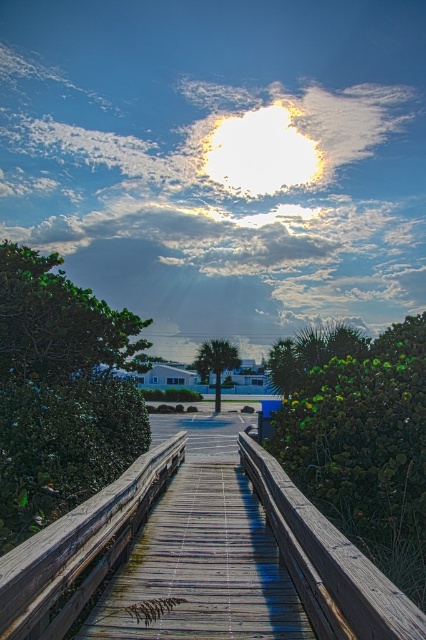
Find the location of a particular element. This screenshot has height=640, width=426. weathered wood boardwalk at center is located at coordinates (x=204, y=552).

Does point (203, 500) come behind point (23, 596)?

Yes, it is behind point (23, 596).

Find the location of a particular element. This screenshot has height=640, width=426. weathered wood boardwalk at center is located at coordinates (204, 552).

Between weathered wood boardwalk at center and wooden at center, which one is positioned higher?

wooden at center is higher up.

Which of these two, weathered wood boardwalk at center or wooden at center, stands shorter?

With less height is wooden at center.

Is point (155, 627) more distant than point (317, 609)?

Yes, it is behind point (317, 609).

At what (x,y) coordinates should I click in order to perform the action: click on weathered wood boardwalk at center. Please return your answer as a coordinate pair (x, y). Looking at the image, I should click on (204, 552).

Which is more to the right, weathered wood rail at center or wooden at center?

wooden at center

Between weathered wood rail at center and wooden at center, which one has less height?

weathered wood rail at center

Where is `weathered wood rail at center`? weathered wood rail at center is located at coordinates (80, 548).